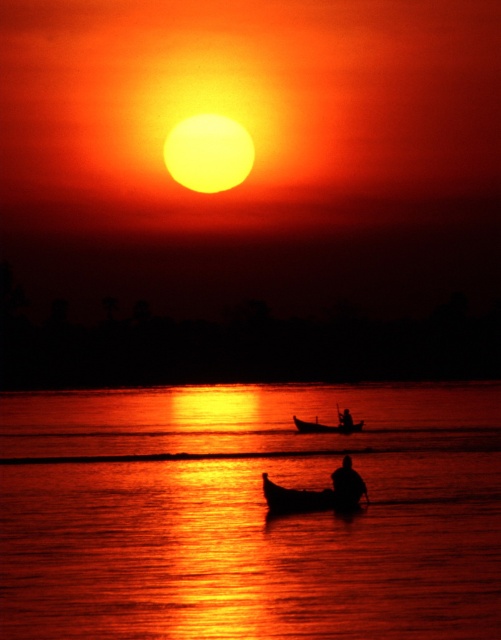
Question: Is silhouette human at center above silhouette wood person at center?

Choices:
 (A) yes
 (B) no

Answer: (A)

Question: Which point is farther to the camera?

Choices:
 (A) silhouette human at center
 (B) smooth wooden boat at center
 (C) wooden boat at center

Answer: (C)

Question: Does silhouette human at center appear over black wood paddle at lower center?

Choices:
 (A) yes
 (B) no

Answer: (B)

Question: Can you confirm if glossy water at center is thinner than wooden boat at center?

Choices:
 (A) no
 (B) yes

Answer: (A)

Question: Which is nearer to the wooden boat at center?

Choices:
 (A) silhouette wood person at center
 (B) black wood paddle at lower center
 (C) smooth wooden boat at center

Answer: (A)

Question: Considering the real-world distances, which object is closest to the black wood paddle at lower center?

Choices:
 (A) smooth wooden boat at center
 (B) glossy water at center

Answer: (B)